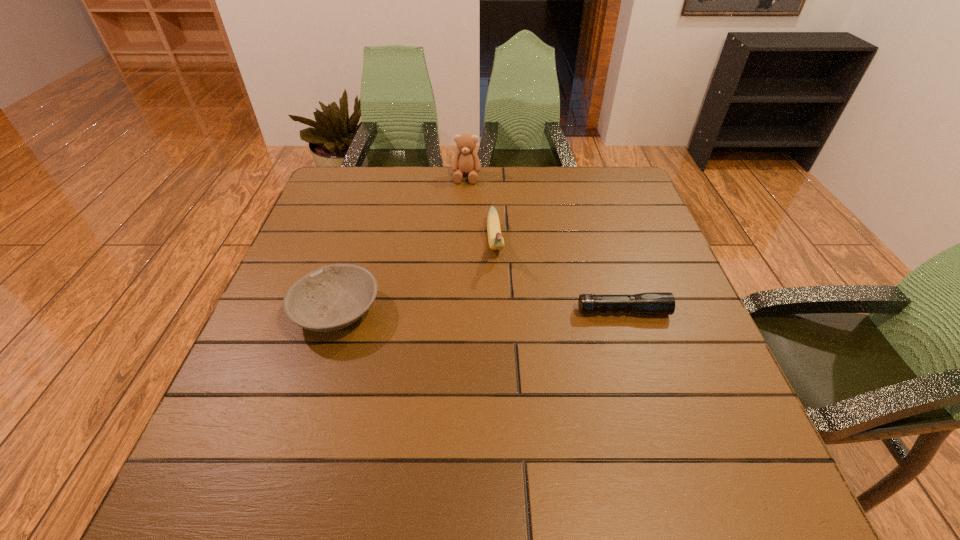
The width and height of the screenshot is (960, 540). In order to click on free space at the right edge of the desktop in this screenshot , I will do `click(621, 253)`.

Find the location of a particular element. Image resolution: width=960 pixels, height=540 pixels. free region at the near left corner of the desktop is located at coordinates (268, 409).

Identify the location of vacant region at the far right corner of the desktop. Image resolution: width=960 pixels, height=540 pixels. (602, 172).

The height and width of the screenshot is (540, 960). In the image, there is a desktop. What are the coordinates of `vacant space at the near right corner` in the screenshot? It's located at (680, 421).

This screenshot has width=960, height=540. In order to click on free space that is in between the tallest object and the third tallest object in this screenshot , I will do `click(401, 244)`.

Identify the location of vacant region between the third shortest object and the flashlight. (559, 278).

This screenshot has width=960, height=540. What are the coordinates of `vacant region between the teddy bear and the bowl` in the screenshot? It's located at (401, 244).

Where is `free area in between the bowl and the second object from right to left`? free area in between the bowl and the second object from right to left is located at coordinates (416, 278).

Find the location of a particular element. The height and width of the screenshot is (540, 960). vacant space that is in between the second object from left to right and the flashlight is located at coordinates (544, 244).

This screenshot has height=540, width=960. I want to click on unoccupied area between the second farthest object and the tallest object, so click(481, 210).